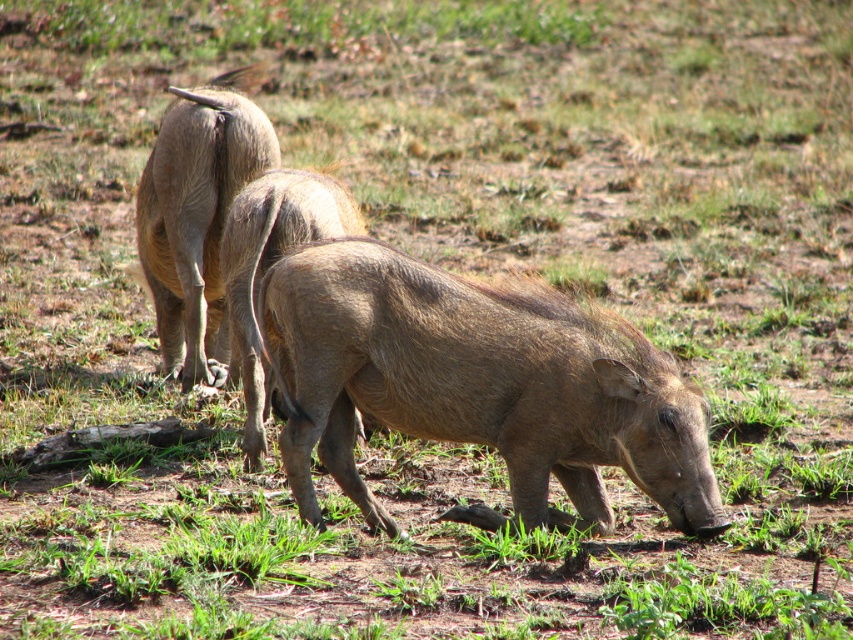
Who is more forward, (570, 358) or (314, 189)?

Point (570, 358) is in front.

Does brown textured pig at center have a smaller size compared to brown rough skin at center?

Correct, brown textured pig at center occupies less space than brown rough skin at center.

Where is `brown textured pig at center`? The width and height of the screenshot is (853, 640). brown textured pig at center is located at coordinates (477, 385).

This screenshot has width=853, height=640. I want to click on brown textured pig at center, so click(477, 385).

Is point (521, 356) behind point (184, 301)?

No, (521, 356) is in front of (184, 301).

Is brown textured pig at center thinner than brown rough skin at upper left?

Incorrect, brown textured pig at center's width is not less than brown rough skin at upper left's.

Is point (567, 486) more distant than point (227, 84)?

No, it is in front of (227, 84).

Find the location of a particular element. The image size is (853, 640). brown textured pig at center is located at coordinates (477, 385).

Does brown rough skin at upper left come behind brown rough skin at center?

A: That is True.

Describe the element at coordinates (196, 211) in the screenshot. I see `brown rough skin at upper left` at that location.

Which is behind, point (173, 362) or point (263, 387)?

Positioned behind is point (173, 362).

Locate an element on the screen. The width and height of the screenshot is (853, 640). brown rough skin at upper left is located at coordinates (196, 211).